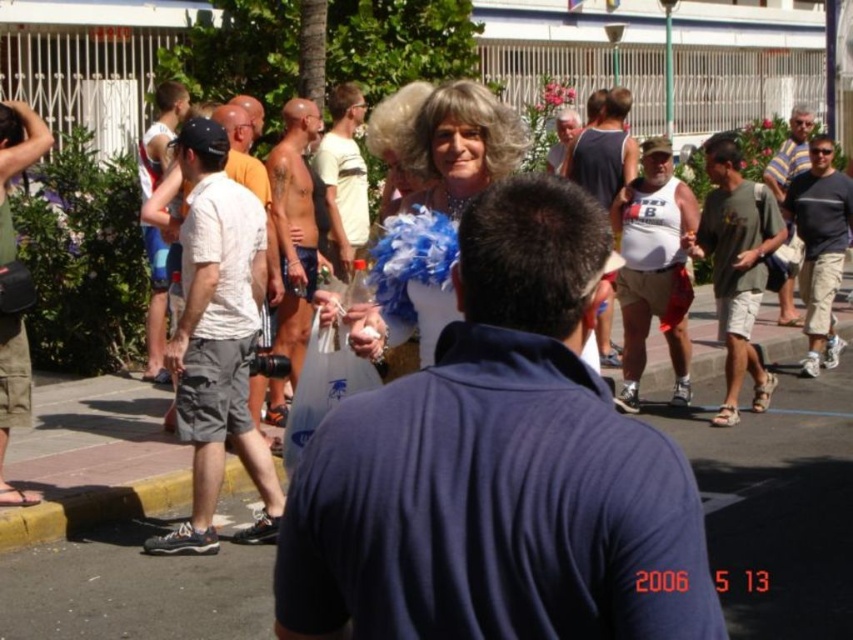
You are standing in the crowd and want to find the matte white shirt at center. Which direction should you look to see the striped cotton shirt at right?

The striped cotton shirt at right is located to the right of the matte white shirt at center, so you should look to your right to see it.